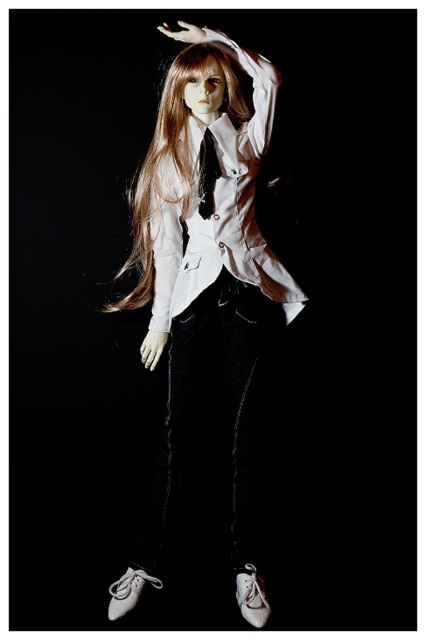
Looking at the figure in the image, which object is positioned to the left of the other between the matte white shirt at center and the black satin tie at center?

The matte white shirt at center is positioned to the left of the black satin tie at center.

You are a fashion designer trying to create a matching accessory for the outfit. Given that the matte white shirt at center and black satin tie at center are part of the current design, which item should you consider resizing to maintain proportionality?

The matte white shirt at center is bigger than the black satin tie at center. To maintain proportionality, you should consider resizing the black satin tie at center to be larger so it matches the scale of the matte white shirt at center.

Consider the image. You are a fashion designer observing the mannequin in the image. You need to place a new accessory between the white leather shoe at lower center and the black satin tie at center. Where should you place it to ensure it is between them?

The white leather shoe at lower center is to the left of the black satin tie at center, so placing the accessory between them would require positioning it to the right of the white leather shoe at lower center and to the left of the black satin tie at center.